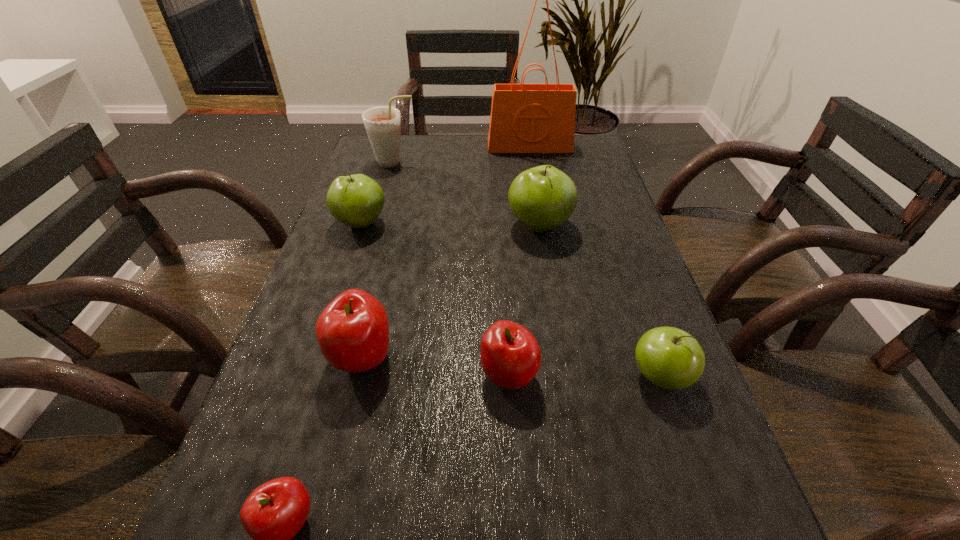
What are the coordinates of `vacant space that satisfies the following two spatial constraints: 1. on the drink side of the seventh nearest object; 2. on the left side of the smallest green apple` in the screenshot? It's located at (332, 376).